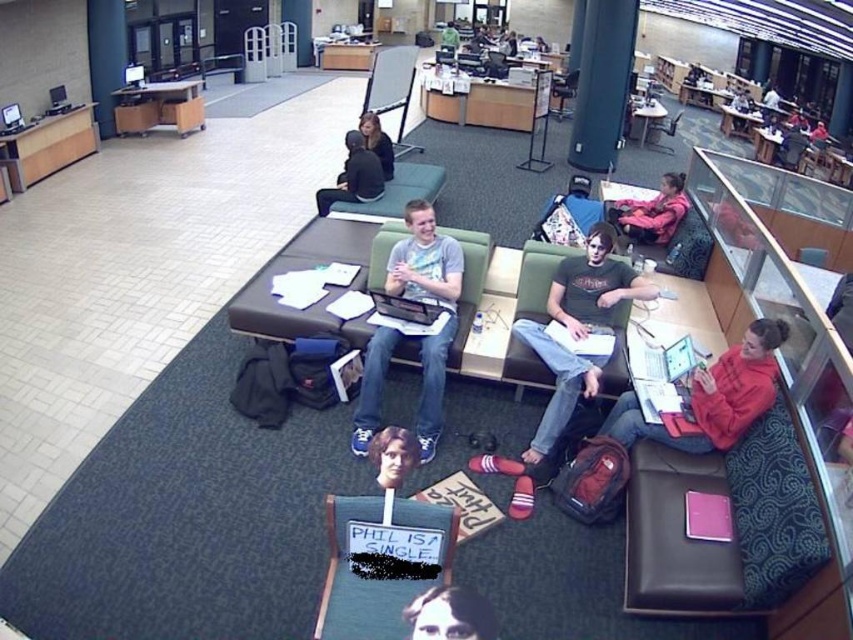
Who is higher up, green fabric couch at center or green fabric chair at center?

green fabric chair at center

Locate an element on the screen. The height and width of the screenshot is (640, 853). green fabric couch at center is located at coordinates (537, 278).

Is point (622, 332) more distant than point (381, 236)?

No.

At what (x,y) coordinates should I click in order to perform the action: click on green fabric couch at center. Please return your answer as a coordinate pair (x, y). This screenshot has height=640, width=853. Looking at the image, I should click on (537, 278).

Is light gray t-shirt at center above green fabric chair at center?

No, light gray t-shirt at center is not above green fabric chair at center.

Is point (432, 339) positioned before point (463, 332)?

Yes, it is in front of point (463, 332).

This screenshot has width=853, height=640. What are the coordinates of `light gray t-shirt at center` in the screenshot? It's located at (413, 326).

Image resolution: width=853 pixels, height=640 pixels. What are the coordinates of `matte pink hoodie at center` in the screenshot? It's located at (651, 212).

Looking at this image, who is more distant from viewer, (666, 236) or (364, 118)?

Point (364, 118)

In order to click on matte pink hoodie at center in this screenshot , I will do `click(651, 212)`.